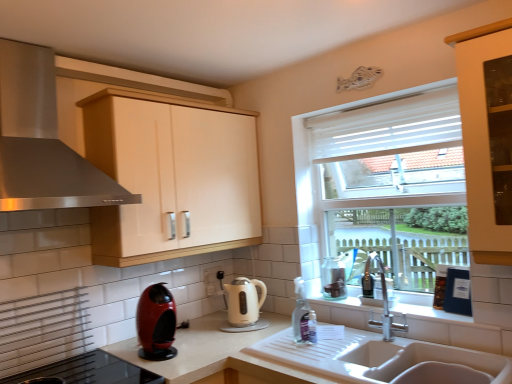
The width and height of the screenshot is (512, 384). I want to click on vacant area that is in front of white glossy electric kettle at center, marked as the second kitchen appliance in a front-to-back arrangement, so click(234, 337).